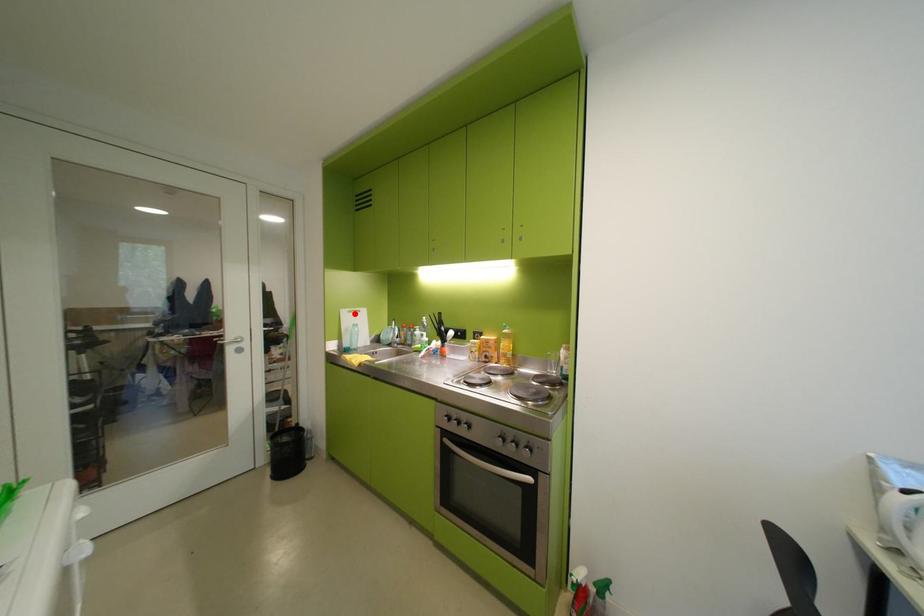
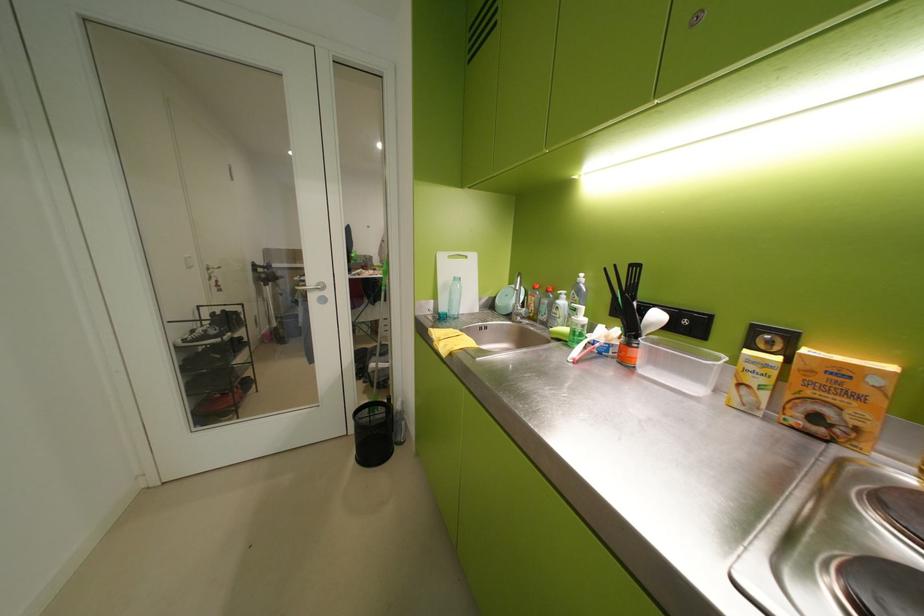
The point at the highlighted location is marked in the first image. Where is the corresponding point in the second image?

(453, 259)